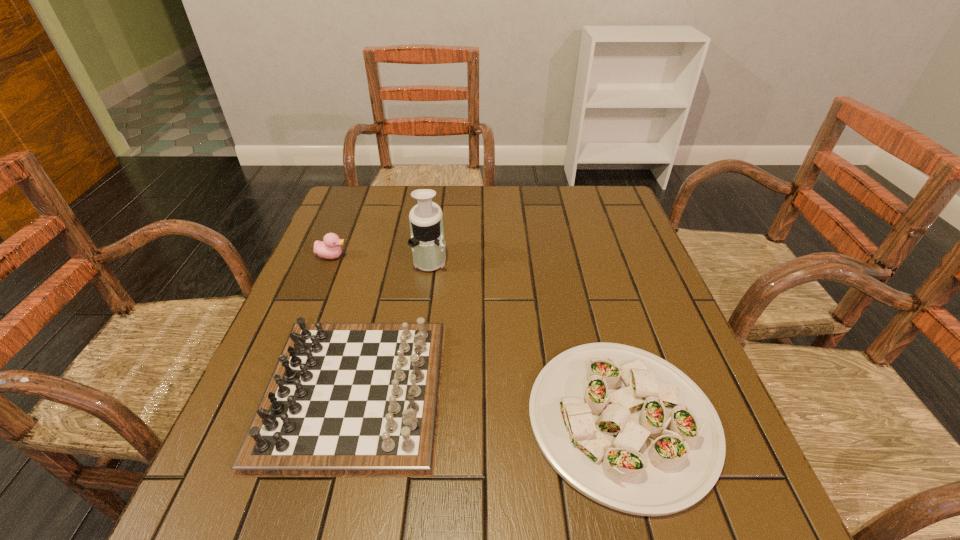
Where is `free spot between the tallest object and the duckling`? Image resolution: width=960 pixels, height=540 pixels. free spot between the tallest object and the duckling is located at coordinates (381, 257).

I want to click on free point between the platter and the juicer, so click(526, 339).

Identify the location of vacant area that lies between the shortest object and the duckling. (477, 338).

Image resolution: width=960 pixels, height=540 pixels. Find the location of `vacant area that lies between the shortest object and the juicer`. vacant area that lies between the shortest object and the juicer is located at coordinates 526,339.

Identify the location of object that ranks as the closest to the tallest object. (329, 248).

Locate which object ranks in proximity to the chessboard. Please provide its 2D coordinates. Your answer should be formatted as a tuple, i.e. [(x, y)], where the tuple contains the x and y coordinates of a point satisfying the conditions above.

[(629, 430)]

Locate an element on the screen. Image resolution: width=960 pixels, height=540 pixels. vacant area that satisfies the following two spatial constraints: 1. on the front-facing side of the duckling; 2. on the back side of the juicer is located at coordinates (331, 259).

Identify the location of free space that satisfies the following two spatial constraints: 1. on the front-facing side of the duckling; 2. on the right side of the tallest object. (331, 259).

Locate an element on the screen. This screenshot has width=960, height=540. vacant space that satisfies the following two spatial constraints: 1. on the front-facing side of the duckling; 2. on the right side of the tallest object is located at coordinates pyautogui.click(x=331, y=259).

At what (x,y) coordinates should I click in order to perform the action: click on vacant space that satisfies the following two spatial constraints: 1. from the player's perspective of the shortest object; 2. on the right side of the chessboard. Please return your answer as a coordinate pair (x, y). This screenshot has width=960, height=540. Looking at the image, I should click on (348, 419).